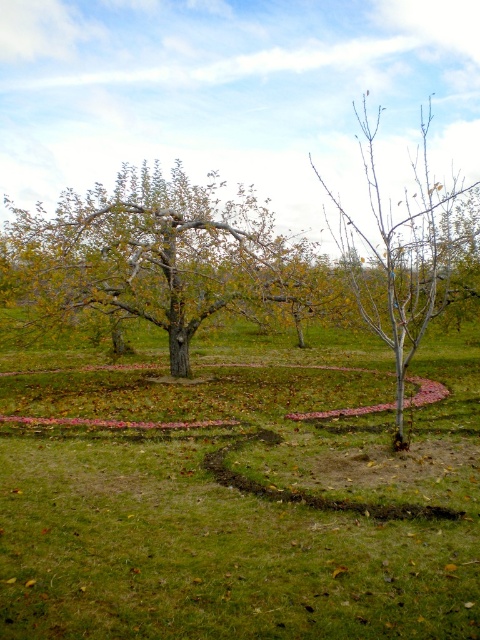
You are standing in an autumn orchard and see two points marked on the ground. The first point is at coordinate point(382, 396) and the second is at point(406, 262). Which point is closer to you?

Point(382, 396) is in front of point(406, 262), so it is closer to you.

You are planning to plant a new tree in your backyard. You have two options based on the image provided. The first option is the green leafy tree at center, and the second is the bare branches at center. Considering their widths, which tree would require more space in your garden?

The green leafy tree at center has a greater width than the bare branches at center, so it would require more space in the garden.

You are an apple picker in an orchard and need to reach the apples on the green leafy tree at center and the bare branches at center. Which tree should you prioritize first based on their positions?

The green leafy tree at center is positioned on the left side of the bare branches at center, so you should prioritize the green leafy tree at center first since it is closer to your current position on the left.